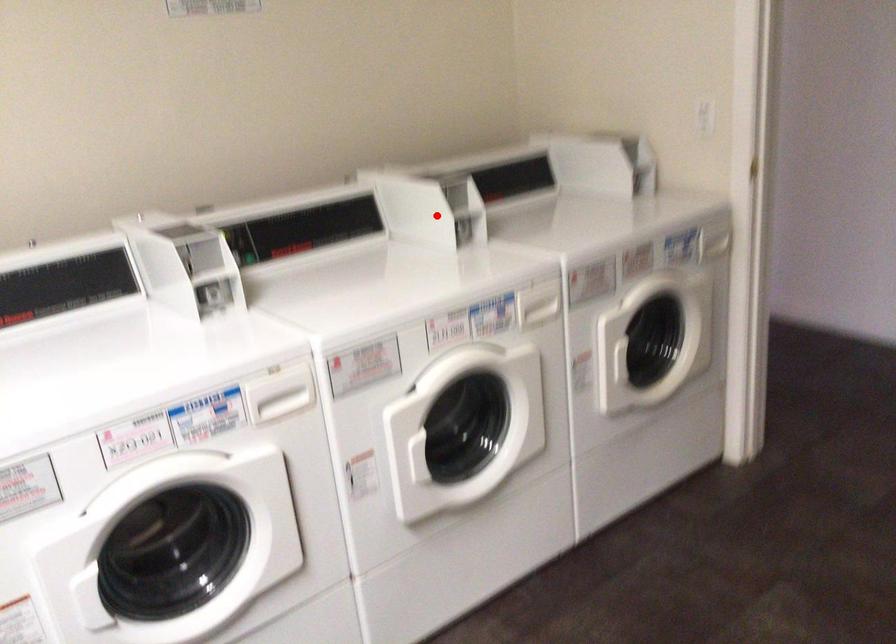
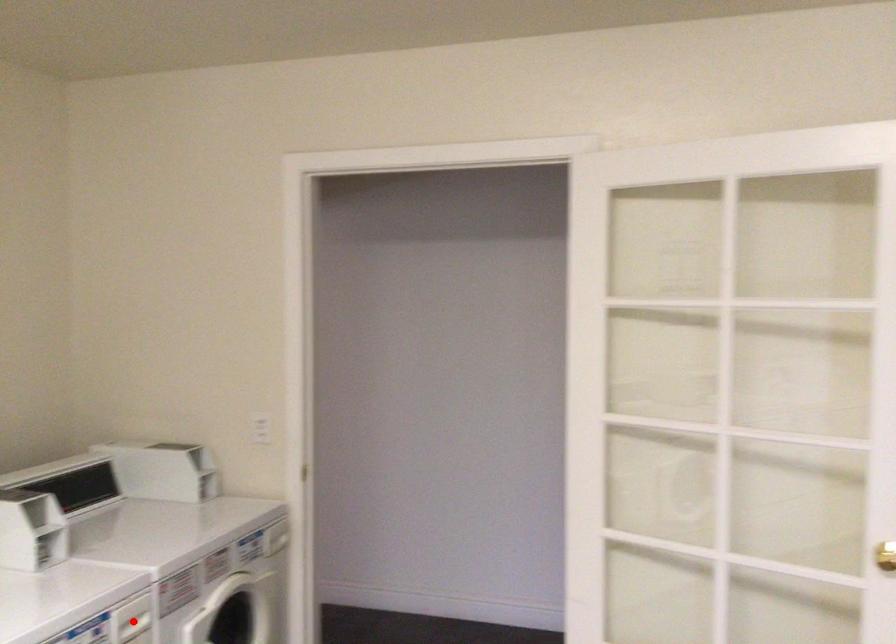
I am providing you with two images of the same scene from different viewpoints. A red point is marked on the first image and another point is marked on the second image. Are the points marked in image1 and image2 representing the same 3D position?

No